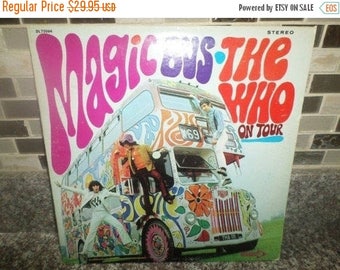
Where is `backsplash`? The image size is (340, 270). backsplash is located at coordinates (312, 127).